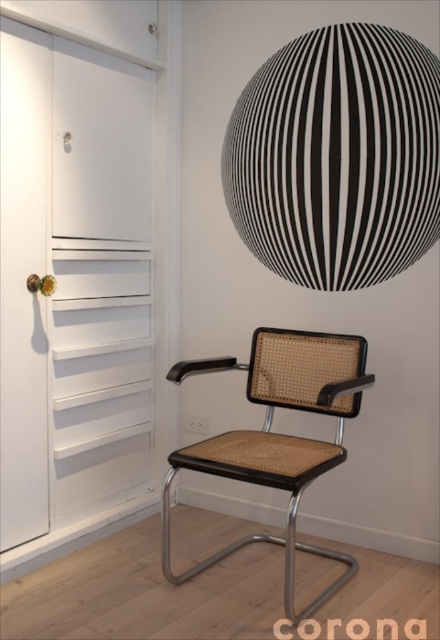
You are an interior designer planning to move a large sofa into this room. The sofa is wider than the white matte door at left but narrower than the brown cane swivel chair at center. Based on the space occupied by these objects, can the sofa fit through the doorway?

The white matte door at left occupies less space than the brown cane swivel chair at center. Since the sofa is narrower than the brown cane swivel chair at center, it is wider than the white matte door at left. Therefore, the sofa may not fit through the doorway as it is wider than the door itself.

Consider the image. You are standing in the room and want to exit through the door. The door is located at coordinates point (x=99, y=280). Can you walk directly to the door without moving around any furniture?

The point (x=99, y=280) marks the white matte door at left, so yes, you can walk directly to the door without moving around any furniture since there is no mention of obstacles between you and the door.